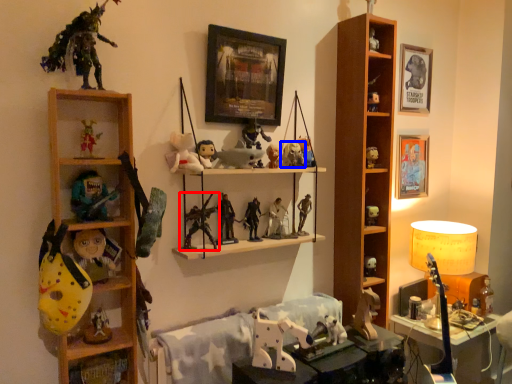
Question: Which object appears farthest to the camera in this image, toy (highlighted by a red box) or toy (highlighted by a blue box)?

Choices:
 (A) toy
 (B) toy

Answer: (B)